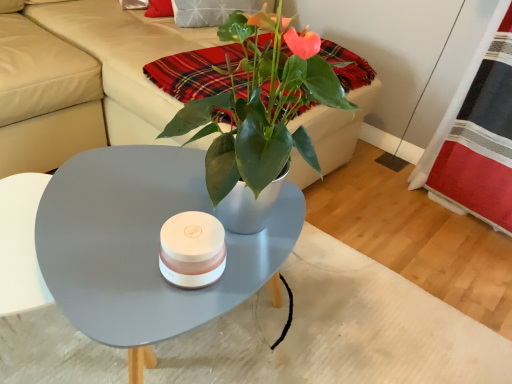
Question: Considering their positions, is beige leather couch at upper center located in front of or behind red plaid fabric at right?

Choices:
 (A) front
 (B) behind

Answer: (A)

Question: Do you think beige leather couch at upper center is within red plaid fabric at right, or outside of it?

Choices:
 (A) outside
 (B) inside

Answer: (A)

Question: Estimate the real-world distances between objects in this image. Which object is farther from the matte gray coffee table at center?

Choices:
 (A) plaid fabric at upper center
 (B) red plaid fabric at right
 (C) beige leather couch at upper center

Answer: (B)

Question: Which is nearer to the plaid fabric at upper center?

Choices:
 (A) matte gray coffee table at center
 (B) beige leather couch at upper center
 (C) red plaid fabric at right

Answer: (A)